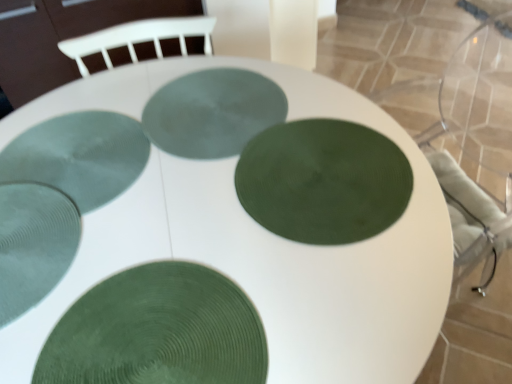
Where is `free space underneath green textured glass plate at center, positioned as the 3th glass plate in back-to-front order (from a real-world perspective)`? This screenshot has height=384, width=512. free space underneath green textured glass plate at center, positioned as the 3th glass plate in back-to-front order (from a real-world perspective) is located at coordinates (312, 182).